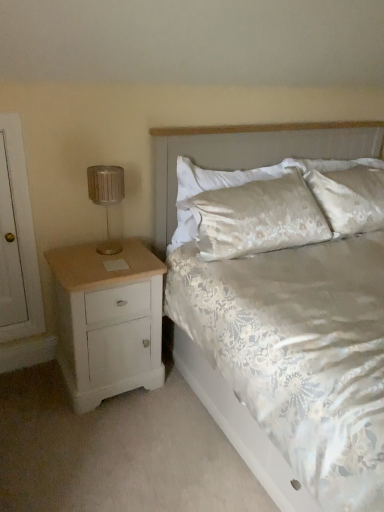
Question: From the image's perspective, is white painted wood nightstand at left located beneath white floral fabric bed at center?

Choices:
 (A) no
 (B) yes

Answer: (B)

Question: Can you see white painted wood nightstand at left touching white floral fabric bed at center?

Choices:
 (A) no
 (B) yes

Answer: (A)

Question: Is white painted wood nightstand at left outside white floral fabric bed at center?

Choices:
 (A) yes
 (B) no

Answer: (B)

Question: Is white painted wood nightstand at left surrounding white floral fabric bed at center?

Choices:
 (A) no
 (B) yes

Answer: (A)

Question: Is white painted wood nightstand at left not near white floral fabric bed at center?

Choices:
 (A) yes
 (B) no

Answer: (B)

Question: Is white painted wood nightstand at left wider than white floral fabric bed at center?

Choices:
 (A) yes
 (B) no

Answer: (B)

Question: From the image's perspective, is metallic silver lamp at left on top of white floral fabric bed at center?

Choices:
 (A) yes
 (B) no

Answer: (A)

Question: Is metallic silver lamp at left beside white floral fabric bed at center?

Choices:
 (A) yes
 (B) no

Answer: (B)

Question: From a real-world perspective, is metallic silver lamp at left on top of white floral fabric bed at center?

Choices:
 (A) yes
 (B) no

Answer: (A)

Question: Is metallic silver lamp at left not within white floral fabric bed at center?

Choices:
 (A) no
 (B) yes

Answer: (A)

Question: Does metallic silver lamp at left have a greater height compared to white floral fabric bed at center?

Choices:
 (A) yes
 (B) no

Answer: (B)

Question: Is metallic silver lamp at left to the left of white floral fabric bed at center from the viewer's perspective?

Choices:
 (A) yes
 (B) no

Answer: (A)

Question: Is satin fabric headboard at upper center taller than metallic silver lamp at left?

Choices:
 (A) yes
 (B) no

Answer: (A)